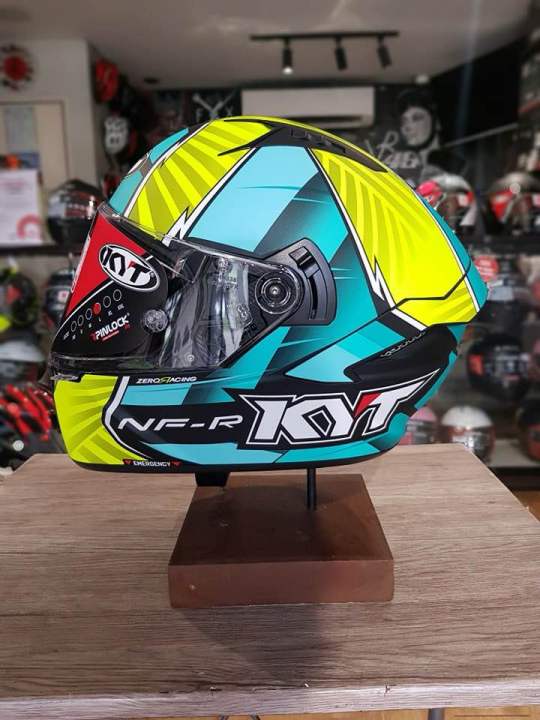
Image resolution: width=540 pixels, height=720 pixels. Find the location of `shelves`. shelves is located at coordinates (509, 459), (470, 394), (497, 245), (38, 248), (483, 135).